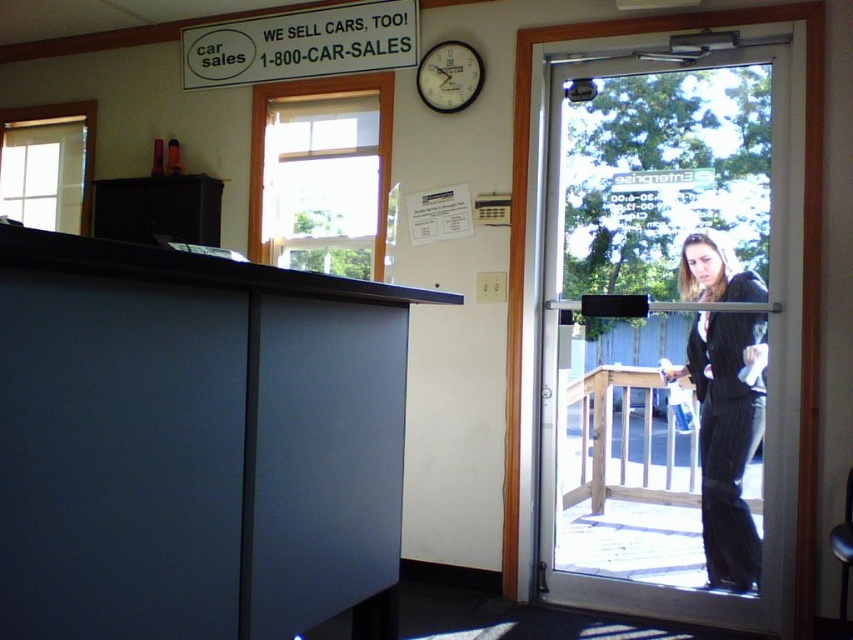
You are a customer entering the dealership and see the transparent glass door at right and the black pinstripe suit at door. Which object is closer to the entrance?

The transparent glass door at right is closer to the entrance because it is positioned to the left of the black pinstripe suit at door, indicating it is nearer to the entry point.